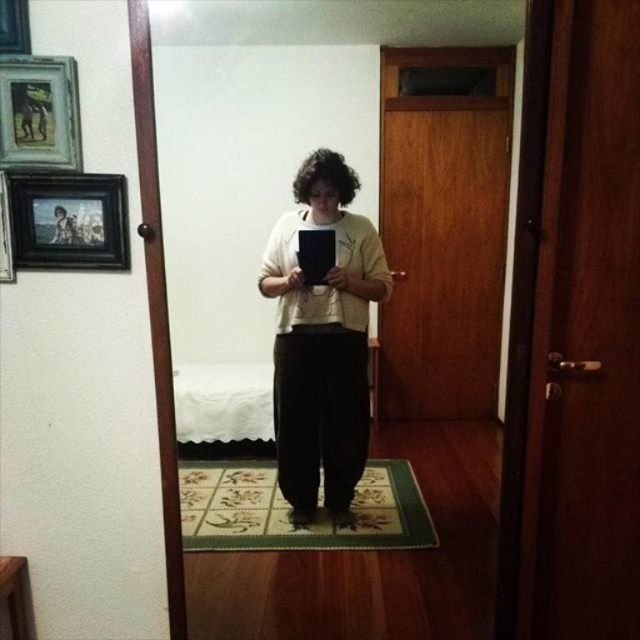
Question: Does wooden framed picture at upper left have a smaller size compared to black matte picture frame at upper left?

Choices:
 (A) no
 (B) yes

Answer: (A)

Question: Which object is closer to the camera taking this photo?

Choices:
 (A) black glossy picture frame at upper left
 (B) wooden framed picture at upper left

Answer: (B)

Question: Which point is farther to the camera?

Choices:
 (A) click(x=97, y=252)
 (B) click(x=3, y=150)
 (C) click(x=380, y=268)

Answer: (C)

Question: Can you confirm if matte beige sweater at center is wider than black matte picture frame at upper left?

Choices:
 (A) yes
 (B) no

Answer: (A)

Question: In this image, where is black glossy picture frame at upper left located relative to black matte picture frame at upper left?

Choices:
 (A) above
 (B) below

Answer: (A)

Question: Among these objects, which one is nearest to the camera?

Choices:
 (A) black matte picture frame at upper left
 (B) matte beige sweater at center
 (C) black glossy picture frame at upper left
 (D) wooden framed picture at upper left

Answer: (D)